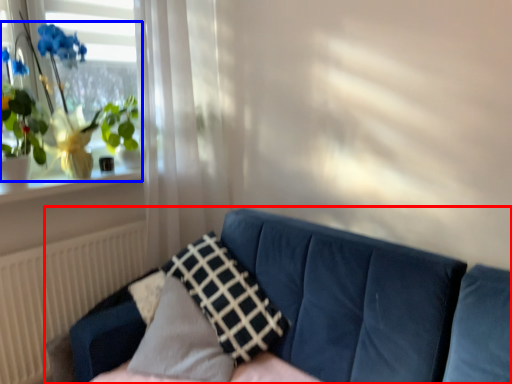
Question: Which point is further to the camera, studio couch (highlighted by a red box) or houseplant (highlighted by a blue box)?

Choices:
 (A) studio couch
 (B) houseplant

Answer: (B)